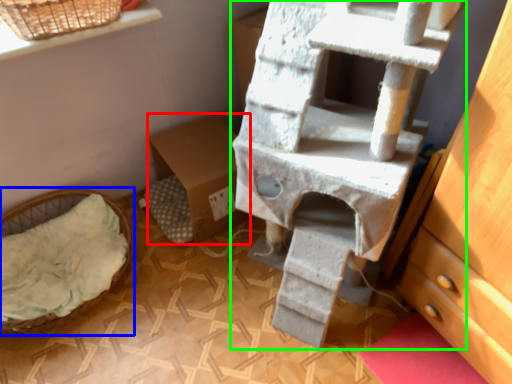
Question: Based on their relative distances, which object is nearer to cardboard box (highlighted by a red box)? Choose from furniture (highlighted by a blue box) and bunk bed (highlighted by a green box).

Choices:
 (A) furniture
 (B) bunk bed

Answer: (A)